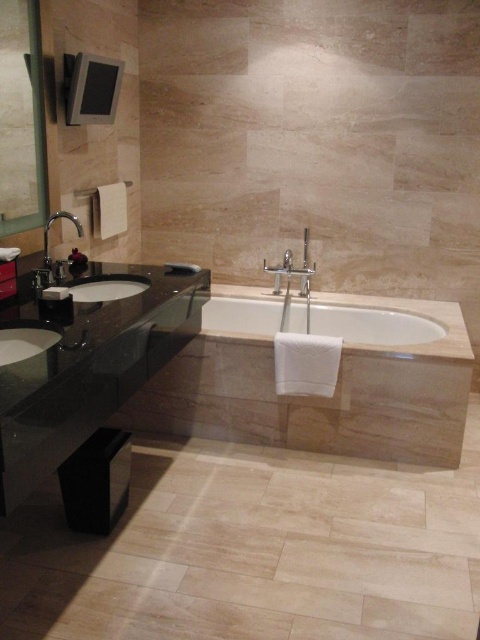
Who is shorter, matte glass mirror at upper left or white glossy bathtub at center?

With less height is white glossy bathtub at center.

Who is higher up, matte glass mirror at upper left or white glossy bathtub at center?

matte glass mirror at upper left is higher up.

Is point (43, 125) positioned before point (324, 317)?

Yes, point (43, 125) is closer to viewer.

You are a GUI agent. You are given a task and a screenshot of the screen. Output one action in this format:
    pyautogui.click(x=<x>, y=<y>)
    Task: Click on the matte glass mirror at upper left
    This screenshot has width=480, height=640.
    Given the screenshot: What is the action you would take?
    pyautogui.click(x=21, y=118)

Which is below, black granite vanity at lower left or satin nickel faucet at left?

Positioned lower is black granite vanity at lower left.

Who is higher up, black granite vanity at lower left or satin nickel faucet at left?

satin nickel faucet at left

What do you see at coordinates (86, 365) in the screenshot? The image size is (480, 640). I see `black granite vanity at lower left` at bounding box center [86, 365].

Locate an element on the screen. black granite vanity at lower left is located at coordinates (86, 365).

Between matte glass mirror at upper left and white glossy sink at lower left, which one is positioned higher?

matte glass mirror at upper left is higher up.

Which is in front, point (11, 64) or point (16, 330)?

Point (16, 330)

I want to click on matte glass mirror at upper left, so click(x=21, y=118).

At what (x,y) coordinates should I click in order to perform the action: click on matte glass mirror at upper left. Please return your answer as a coordinate pair (x, y). This screenshot has height=640, width=480. Looking at the image, I should click on (21, 118).